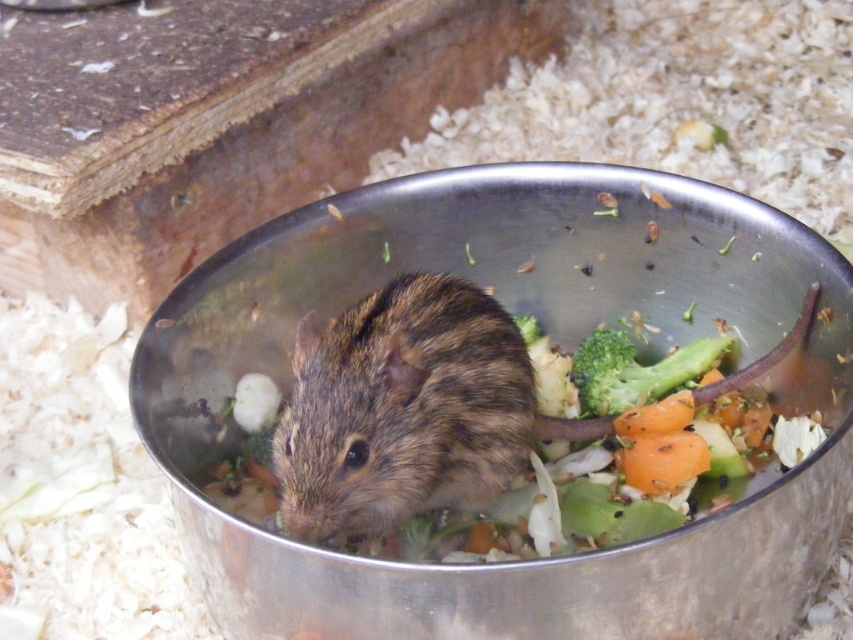
Question: Can you confirm if metallic silver bowl at center is bigger than brown fuzzy mouse at center?

Choices:
 (A) yes
 (B) no

Answer: (A)

Question: Which is farther from the brown fuzzy mouse at center?

Choices:
 (A) orange matte carrot at center
 (B) green matte broccoli at center

Answer: (B)

Question: Which point is closer to the camera?

Choices:
 (A) green matte broccoli at center
 (B) metallic silver bowl at center

Answer: (B)

Question: Can you confirm if metallic silver bowl at center is smaller than brown fuzzy mouse at center?

Choices:
 (A) yes
 (B) no

Answer: (B)

Question: Which object is positioned farthest from the green matte broccoli at center?

Choices:
 (A) orange matte carrot at center
 (B) brown fuzzy mouse at center
 (C) metallic silver bowl at center

Answer: (B)

Question: Is metallic silver bowl at center further to camera compared to orange matte carrot at center?

Choices:
 (A) yes
 (B) no

Answer: (B)